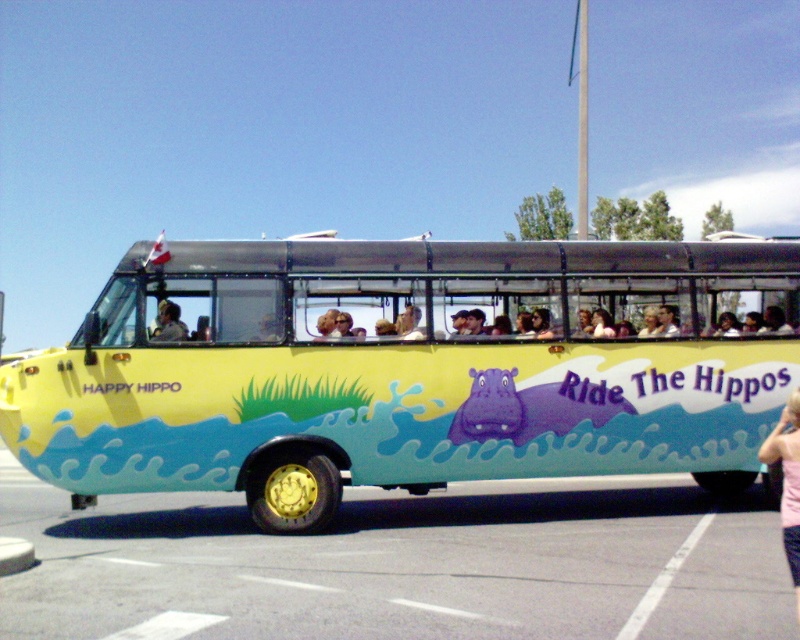
You are standing in front of the yellow matte bus at center and the light brown leather jacket at center. Which object is nearer to you?

The yellow matte bus at center is closer to the viewer than the light brown leather jacket at center.